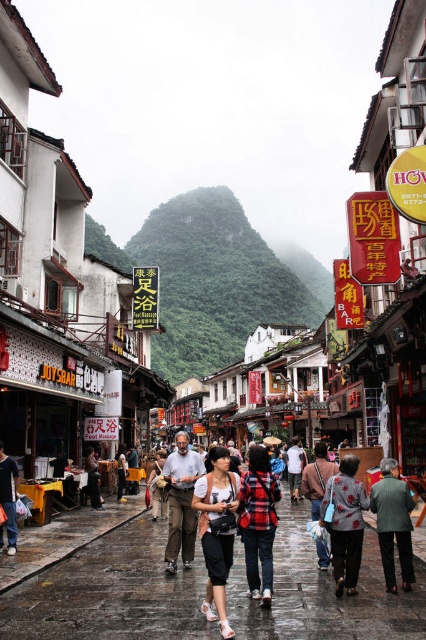
Question: Which object appears closest to the camera in this image?

Choices:
 (A) dark gray fabric jacket at lower right
 (B) green textured mountain at center

Answer: (A)

Question: Estimate the real-world distances between objects in this image. Which object is farther from the dark gray fabric pants at lower left?

Choices:
 (A) light brown leather jacket at center
 (B) red plaid shirt at center
 (C) floral-patterned sweater at center
 (D) dark gray fabric jacket at lower right

Answer: (D)

Question: From the image, what is the correct spatial relationship of matte black bag at center in relation to dark gray fabric jacket at center?

Choices:
 (A) above
 (B) below

Answer: (B)

Question: Does matte black shirt at center appear on the right side of light brown leather jacket at center?

Choices:
 (A) yes
 (B) no

Answer: (A)

Question: Is dark gray fabric pants at lower left wider than dark gray fabric jacket at center?

Choices:
 (A) no
 (B) yes

Answer: (A)

Question: Which of the following is the closest to the observer?

Choices:
 (A) dark gray fabric jacket at lower right
 (B) matte black backpack at center
 (C) matte black bag at center

Answer: (C)